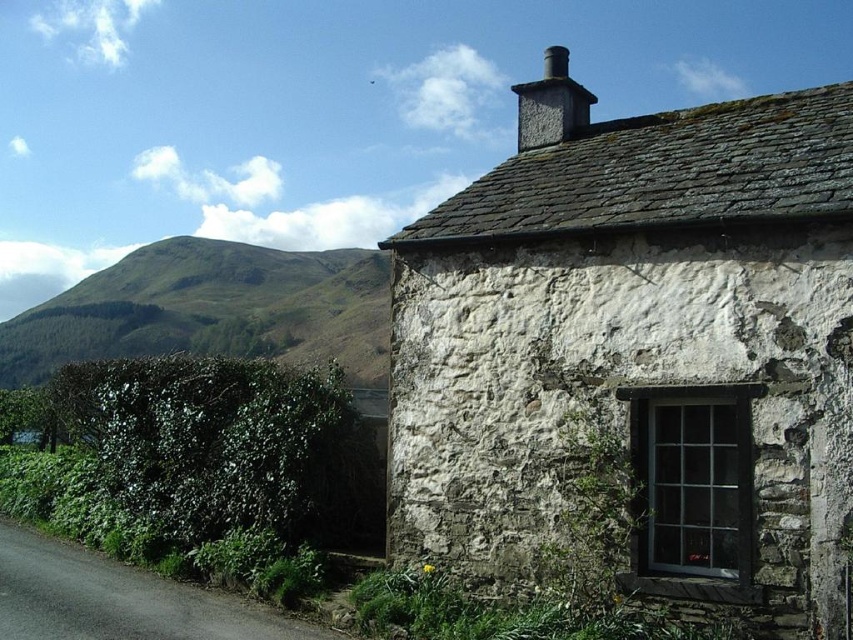
Between green leafy hedge at left and green grassy hillside at upper left, which one appears on the left side from the viewer's perspective?

Positioned to the left is green grassy hillside at upper left.

Is green leafy hedge at left shorter than green grassy hillside at upper left?

→ Yes, green leafy hedge at left is shorter than green grassy hillside at upper left.

Image resolution: width=853 pixels, height=640 pixels. Identify the location of green leafy hedge at left. (201, 452).

Locate an element on the screen. This screenshot has height=640, width=853. green leafy hedge at left is located at coordinates (201, 452).

In order to click on white stone cottage at center in this screenshot , I will do `click(643, 353)`.

Between white stone cottage at center and gray stone chimney at upper center, which one is positioned higher?

gray stone chimney at upper center

Where is `white stone cottage at center`? This screenshot has width=853, height=640. white stone cottage at center is located at coordinates (643, 353).

Can you confirm if green leafy hedge at left is positioned to the right of gray stone chimney at upper center?

Incorrect, green leafy hedge at left is not on the right side of gray stone chimney at upper center.

Is green leafy hedge at left thinner than gray stone chimney at upper center?

Yes, green leafy hedge at left is thinner than gray stone chimney at upper center.

Between point (80, 477) and point (549, 67), which one is positioned behind?

The point (80, 477) is behind.

Find the location of a particular element. This screenshot has height=640, width=853. green leafy hedge at left is located at coordinates (201, 452).